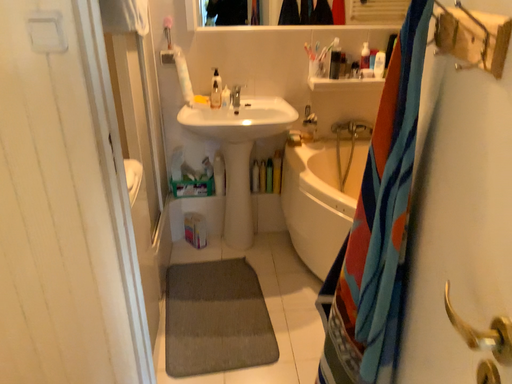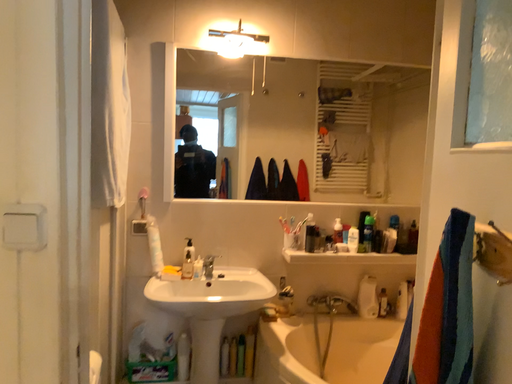
Question: How did the camera likely rotate when shooting the video?

Choices:
 (A) rotated upward
 (B) rotated downward

Answer: (A)